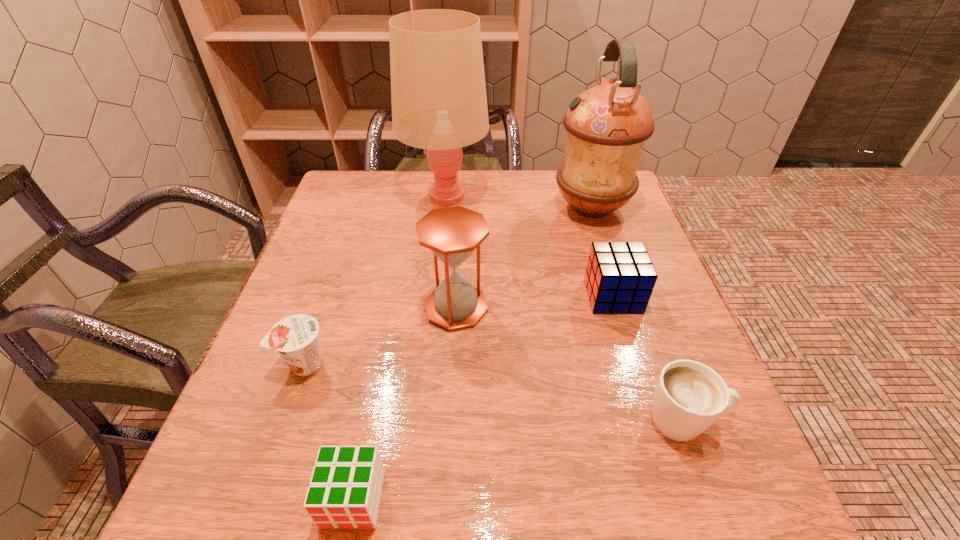
I want to click on lampshade, so click(x=438, y=92).

Find the location of a particular element. The height and width of the screenshot is (540, 960). oil lamp is located at coordinates (607, 125).

You are a GUI agent. You are given a task and a screenshot of the screen. Output one action in this format:
    pyautogui.click(x=<x>, y=<y>)
    Task: Click on the hourglass
    This screenshot has width=960, height=540.
    Given the screenshot: What is the action you would take?
    pyautogui.click(x=452, y=233)

Find the location of a particular element. the farther cube is located at coordinates (619, 278).

You are a GUI agent. You are given a task and a screenshot of the screen. Output one action in this format:
    pyautogui.click(x=<x>, y=<y>)
    Task: Click on the taller cube
    
    Given the screenshot: What is the action you would take?
    pyautogui.click(x=619, y=278)

The width and height of the screenshot is (960, 540). Find the location of `the second nearest object`. the second nearest object is located at coordinates (689, 397).

Where is `yogurt`? Image resolution: width=960 pixels, height=540 pixels. yogurt is located at coordinates (295, 337).

This screenshot has height=540, width=960. Find the location of `the leftmost object`. the leftmost object is located at coordinates (295, 337).

Locate an element on the screen. This screenshot has width=960, height=540. the shorter cube is located at coordinates (345, 490).

Find the location of a particular element. The height and width of the screenshot is (540, 960). the nearest object is located at coordinates (345, 490).